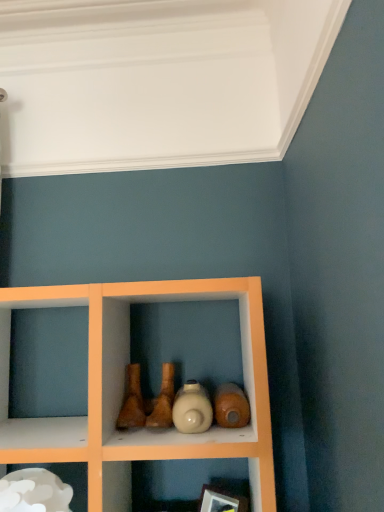
What is the approximate height of matte beige bottle at center?

It is 4.45 inches.

The height and width of the screenshot is (512, 384). What do you see at coordinates (221, 500) in the screenshot?
I see `wooden picture frame at lower center` at bounding box center [221, 500].

Locate an element on the screen. The image size is (384, 512). white glossy cloud at lower left is located at coordinates (66, 479).

Is wooden picture frame at lower center facing away from white glossy cloud at lower left?

No.

From the image's perspective, relative to white glossy cloud at lower left, is wooden picture frame at lower center above or below?

wooden picture frame at lower center is situated lower than white glossy cloud at lower left in the image.

I want to click on picture frame on the right side of white glossy cloud at lower left, so point(221,500).

Looking at this image, in the image, is wooden picture frame at lower center positioned in front of or behind white glossy cloud at lower left?

In the image, wooden picture frame at lower center appears behind white glossy cloud at lower left.

Is point (181, 397) positioned behind point (216, 502)?

No.

Could wooden picture frame at lower center be considered to be inside matte beige bottle at center?

Definitely not — wooden picture frame at lower center is not inside matte beige bottle at center.

Can you confirm if matte beige bottle at center is wider than wooden picture frame at lower center?

Indeed, matte beige bottle at center has a greater width compared to wooden picture frame at lower center.

In terms of height, does matte beige bottle at center look taller or shorter compared to wooden picture frame at lower center?

In the image, matte beige bottle at center appears to be shorter than wooden picture frame at lower center.

Based on the photo, from the image's perspective, is wooden picture frame at lower center located above or below matte beige bottle at center?

wooden picture frame at lower center is below matte beige bottle at center.

Is wooden picture frame at lower center to the left of matte beige bottle at center from the viewer's perspective?

No, wooden picture frame at lower center is not to the left of matte beige bottle at center.

How different are the orientations of wooden picture frame at lower center and matte beige bottle at center in degrees?

There is a 49.6-degree angle between the facing directions of wooden picture frame at lower center and matte beige bottle at center.

Which object is closer to the camera taking this photo, wooden picture frame at lower center or matte beige bottle at center?

matte beige bottle at center is in front.

From the image's perspective, does white glossy cloud at lower left appear lower than wooden picture frame at lower center?

Incorrect, from the image's perspective, white glossy cloud at lower left is higher than wooden picture frame at lower center.

What's the angular difference between white glossy cloud at lower left and wooden picture frame at lower center's facing directions?

white glossy cloud at lower left and wooden picture frame at lower center are facing 43.8 degrees away from each other.

Who is smaller, white glossy cloud at lower left or wooden picture frame at lower center?

wooden picture frame at lower center is smaller.

Identify the location of shelf in front of the matte beige bottle at center. (66, 479).

Considering their positions, is matte beige bottle at center located in front of or behind white glossy cloud at lower left?

Visually, matte beige bottle at center is located behind white glossy cloud at lower left.

From a real-world perspective, which is physically above, matte beige bottle at center or white glossy cloud at lower left?

matte beige bottle at center is physically above.

Looking at this image, who is taller, matte beige bottle at center or white glossy cloud at lower left?

white glossy cloud at lower left.

Measure the distance from white glossy cloud at lower left to matte beige bottle at center.

white glossy cloud at lower left is 41.39 centimeters from matte beige bottle at center.

Is white glossy cloud at lower left next to matte beige bottle at center?

No, white glossy cloud at lower left is not in contact with matte beige bottle at center.

This screenshot has width=384, height=512. Identify the location of shelf on the left of the matte beige bottle at center. (66, 479).

From the picture: Would you say white glossy cloud at lower left is inside or outside matte beige bottle at center?

white glossy cloud at lower left exists outside the volume of matte beige bottle at center.

You are a GUI agent. You are given a task and a screenshot of the screen. Output one action in this format:
    pyautogui.click(x=<x>, y=<y>)
    Task: Click on the shelf lying on the left of wooden picture frame at lower center
    
    Given the screenshot: What is the action you would take?
    pyautogui.click(x=66, y=479)

Find the location of `picture frame below the matte beige bottle at center (from the image's perspective)`. picture frame below the matte beige bottle at center (from the image's perspective) is located at coordinates (221, 500).

Estimate the real-world distances between objects in this image. Which object is further from white glossy cloud at lower left, wooden picture frame at lower center or matte beige bottle at center?

Based on the image, wooden picture frame at lower center appears to be further to white glossy cloud at lower left.

Looking at the image, which one is located further to wooden picture frame at lower center, matte beige bottle at center or white glossy cloud at lower left?

white glossy cloud at lower left is positioned further to the anchor wooden picture frame at lower center.

Considering their positions, is white glossy cloud at lower left positioned closer to matte beige bottle at center than wooden picture frame at lower center?

The object closer to matte beige bottle at center is wooden picture frame at lower center.

Considering their positions, is white glossy cloud at lower left positioned closer to wooden picture frame at lower center than matte beige bottle at center?

Based on the image, matte beige bottle at center appears to be nearer to wooden picture frame at lower center.

Based on their spatial positions, is wooden picture frame at lower center or white glossy cloud at lower left further from matte beige bottle at center?

The object further to matte beige bottle at center is white glossy cloud at lower left.

Looking at the image, which one is located further to white glossy cloud at lower left, matte beige bottle at center or wooden picture frame at lower center?

The object further to white glossy cloud at lower left is wooden picture frame at lower center.

The height and width of the screenshot is (512, 384). I want to click on bottle situated between white glossy cloud at lower left and wooden picture frame at lower center from left to right, so click(x=192, y=409).